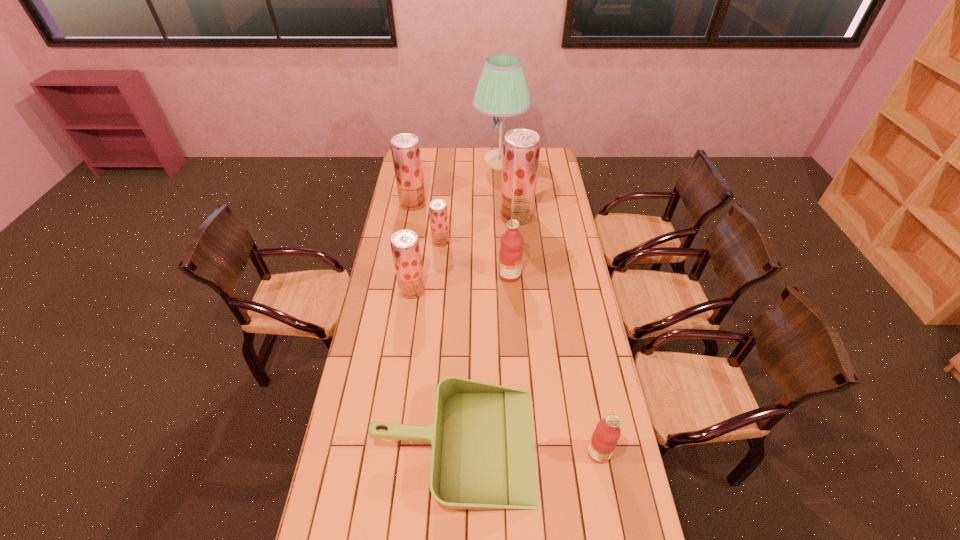
Where is `the smaller pink fruit juice`? The image size is (960, 540). the smaller pink fruit juice is located at coordinates (605, 437).

Where is `the fourth nearest fruit juice`? The width and height of the screenshot is (960, 540). the fourth nearest fruit juice is located at coordinates (438, 212).

Where is `the third fruit juice from left to right`? This screenshot has width=960, height=540. the third fruit juice from left to right is located at coordinates (438, 212).

The width and height of the screenshot is (960, 540). Find the location of `the shortest object`. the shortest object is located at coordinates (483, 456).

Find the location of `vacant area situated on the right of the farthest object`. vacant area situated on the right of the farthest object is located at coordinates (535, 162).

I want to click on free region located on the right of the tallest fruit juice, so click(550, 216).

In order to click on free spot located on the back of the third smallest strawberry fruit juice in this screenshot , I will do `click(420, 164)`.

You are a GUI agent. You are given a task and a screenshot of the screen. Output one action in this format:
    pyautogui.click(x=<x>, y=<y>)
    Task: Click on the vacant space located 0.110m on the left of the second smallest strawberry fruit juice
    
    Given the screenshot: What is the action you would take?
    pyautogui.click(x=374, y=290)

Where is `free region located 0.160m on the label of the farther pink fruit juice`? free region located 0.160m on the label of the farther pink fruit juice is located at coordinates (463, 275).

Identify the location of free space located on the label of the farther pink fruit juice. (444, 275).